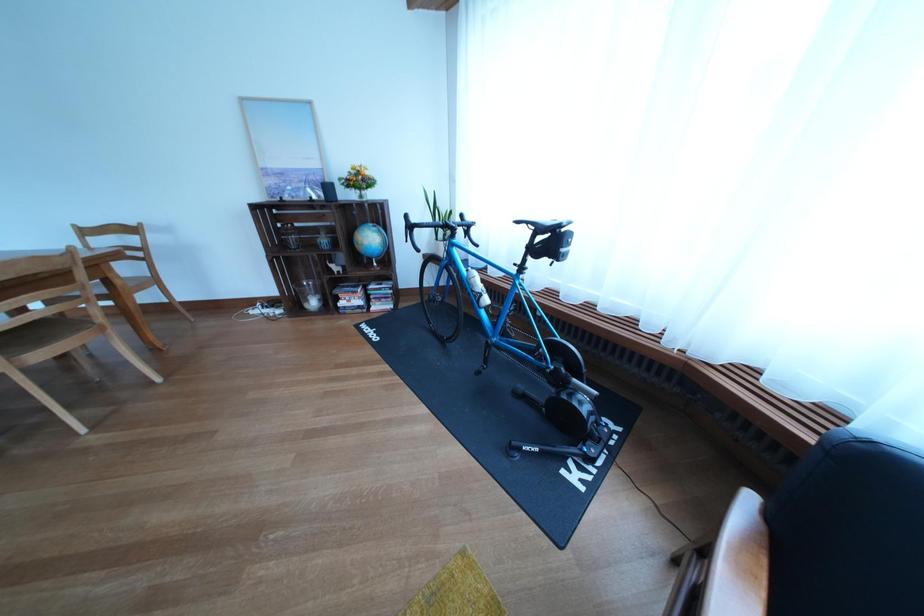
The location [285,146] corresponds to which object?

This point indicates the framed picture.